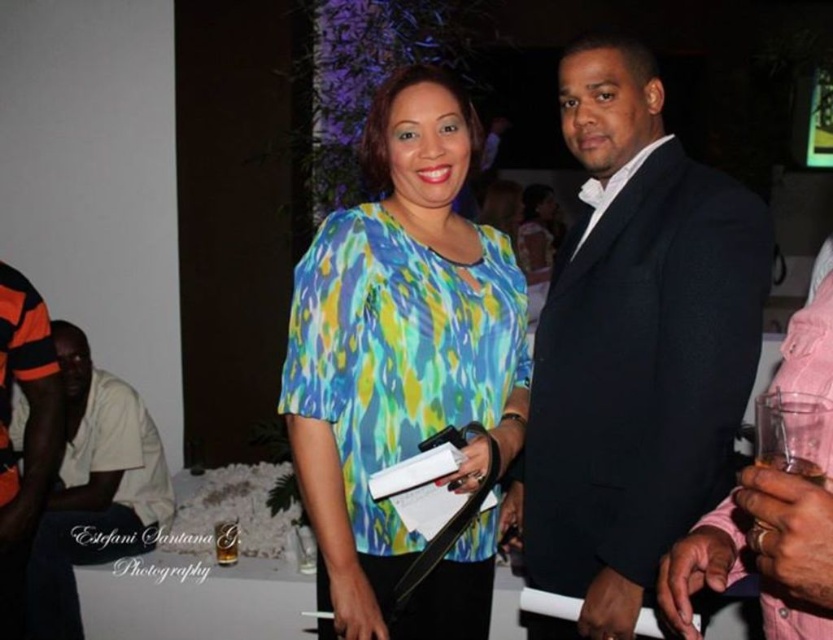
Question: Which is nearer to the orange striped shirt at left?

Choices:
 (A) orange and black striped shirt at left
 (B) printed fabric blouse at center
 (C) black wool suit at center

Answer: (A)

Question: Which point is closer to the camera?

Choices:
 (A) orange and black striped shirt at left
 (B) black wool suit at center

Answer: (B)

Question: Can you confirm if printed fabric blouse at center is positioned to the right of orange and black striped shirt at left?

Choices:
 (A) no
 (B) yes

Answer: (B)

Question: Does black wool suit at center have a larger size compared to orange and black striped shirt at left?

Choices:
 (A) no
 (B) yes

Answer: (B)

Question: Which point is farther from the camera taking this photo?

Choices:
 (A) (33, 403)
 (B) (141, 412)

Answer: (B)

Question: Does black wool suit at center have a greater width compared to orange striped shirt at left?

Choices:
 (A) no
 (B) yes

Answer: (A)